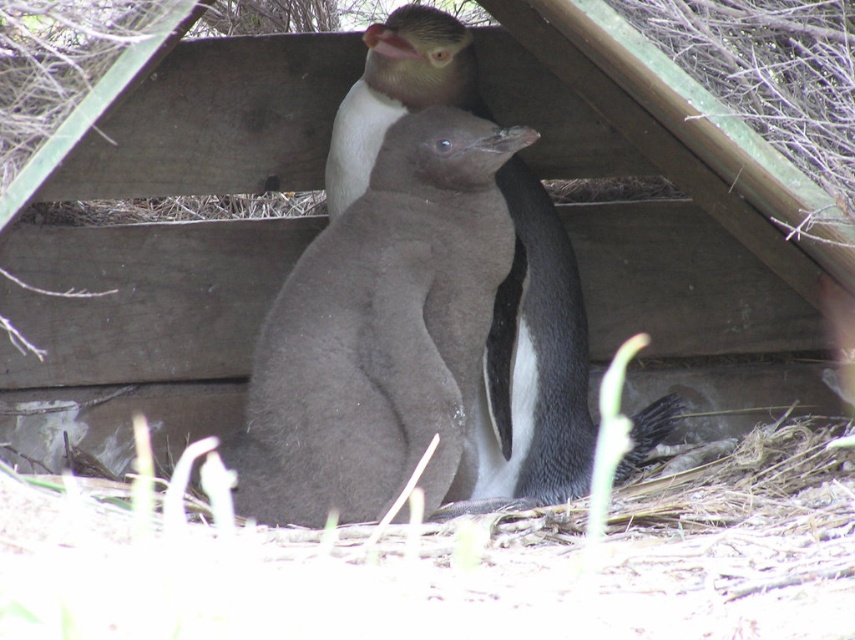
Question: From the image, what is the correct spatial relationship of dark gray downy penguin at center in relation to dark gray feathers at center?

Choices:
 (A) right
 (B) left

Answer: (B)

Question: Does dark gray downy penguin at center appear on the right side of dark gray feathers at center?

Choices:
 (A) no
 (B) yes

Answer: (A)

Question: Is dark gray downy penguin at center bigger than dark gray feathers at center?

Choices:
 (A) no
 (B) yes

Answer: (A)

Question: Which object is farther from the camera taking this photo?

Choices:
 (A) dark gray feathers at center
 (B) dark gray downy penguin at center

Answer: (A)